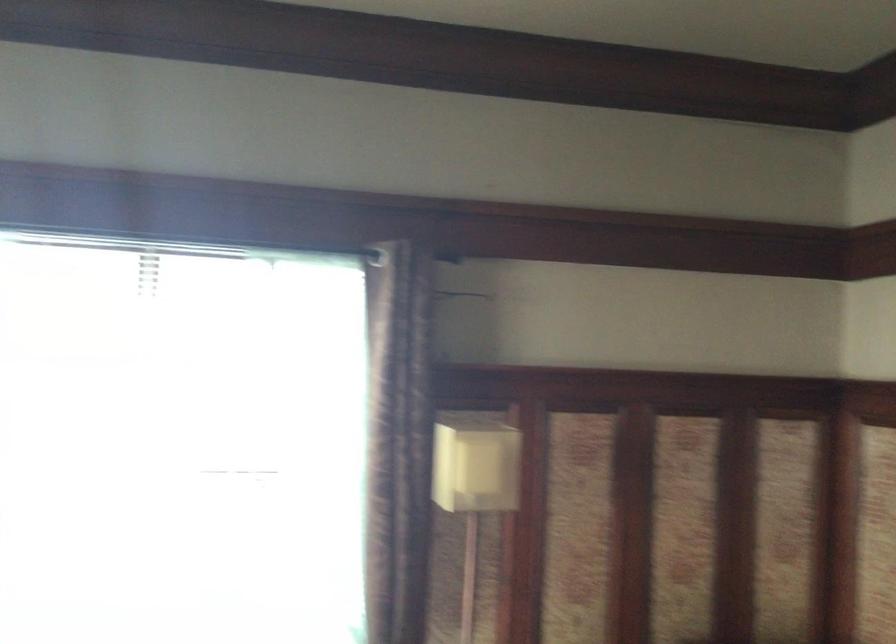
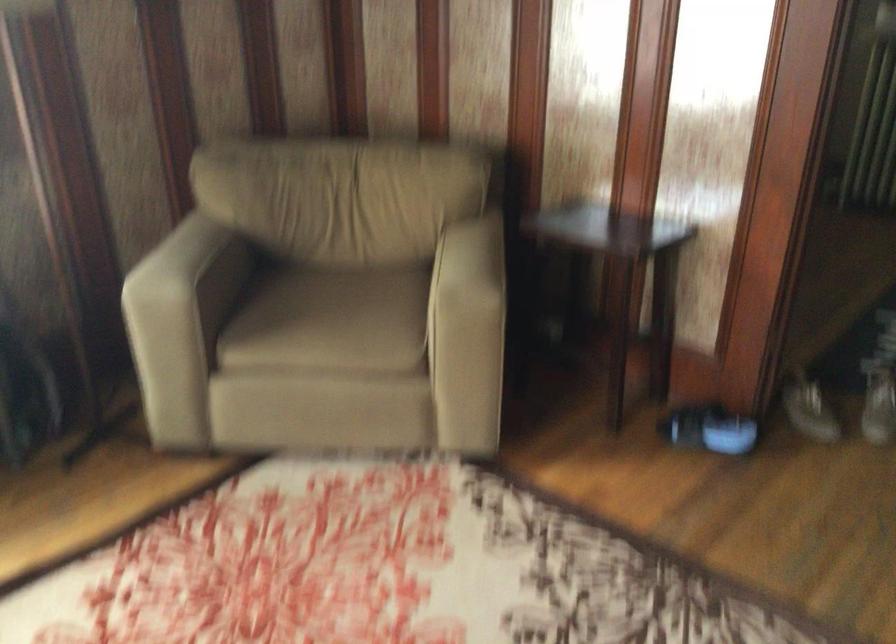
How did the camera likely rotate?

The rotation direction of the camera is right-down.